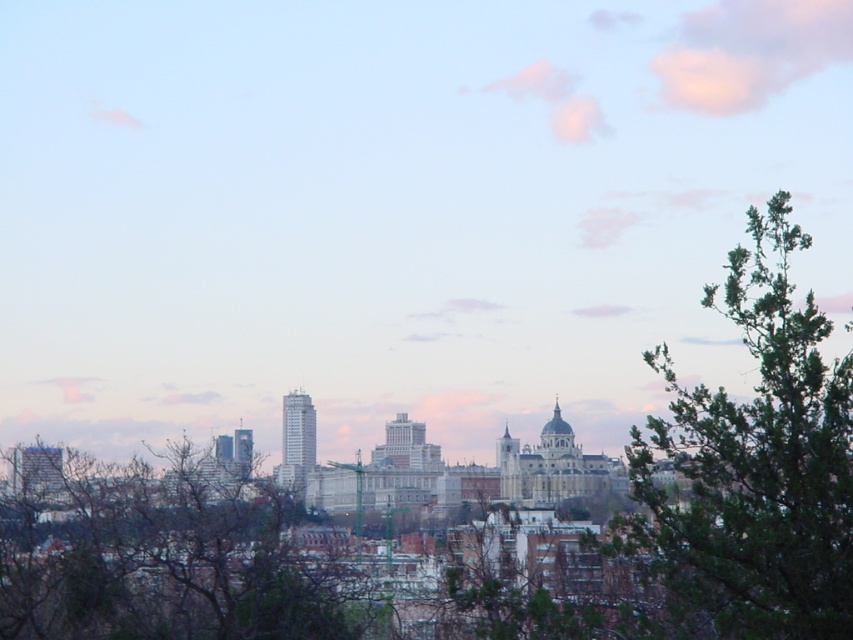
Question: Is green leafy tree at right smaller than bare branches at center?

Choices:
 (A) yes
 (B) no

Answer: (B)

Question: Does green leafy tree at right appear on the left side of bare branches at center?

Choices:
 (A) yes
 (B) no

Answer: (B)

Question: Does green leafy tree at right appear on the right side of bare branches at center?

Choices:
 (A) yes
 (B) no

Answer: (A)